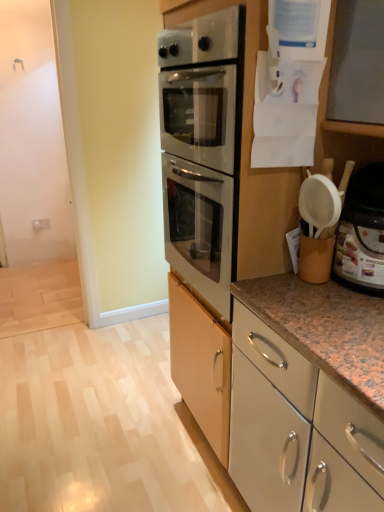
Where is `vacant space to the left of white glossy cabinet at center, which is counted as the second cabinetry, starting from the bottom`? Image resolution: width=384 pixels, height=512 pixels. vacant space to the left of white glossy cabinet at center, which is counted as the second cabinetry, starting from the bottom is located at coordinates pos(124,452).